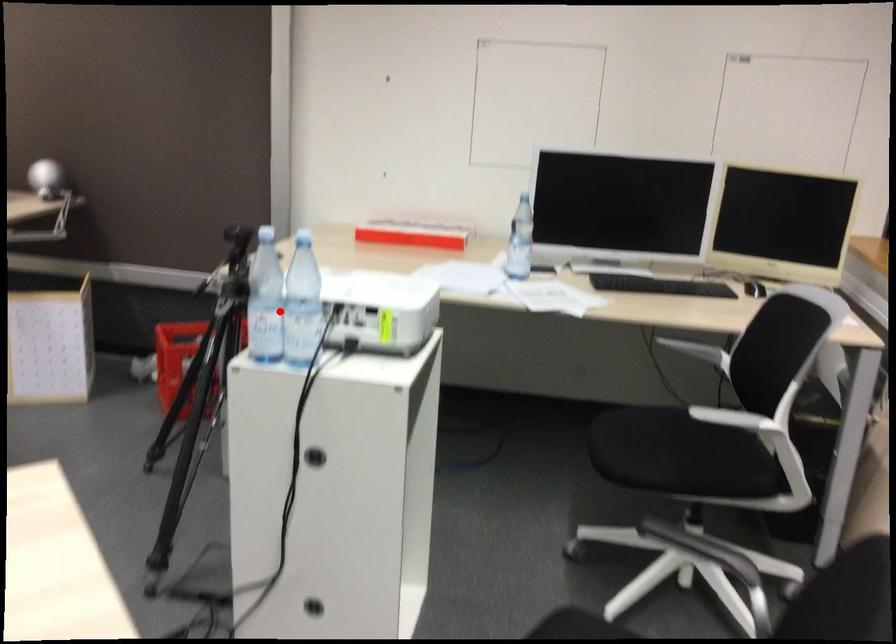
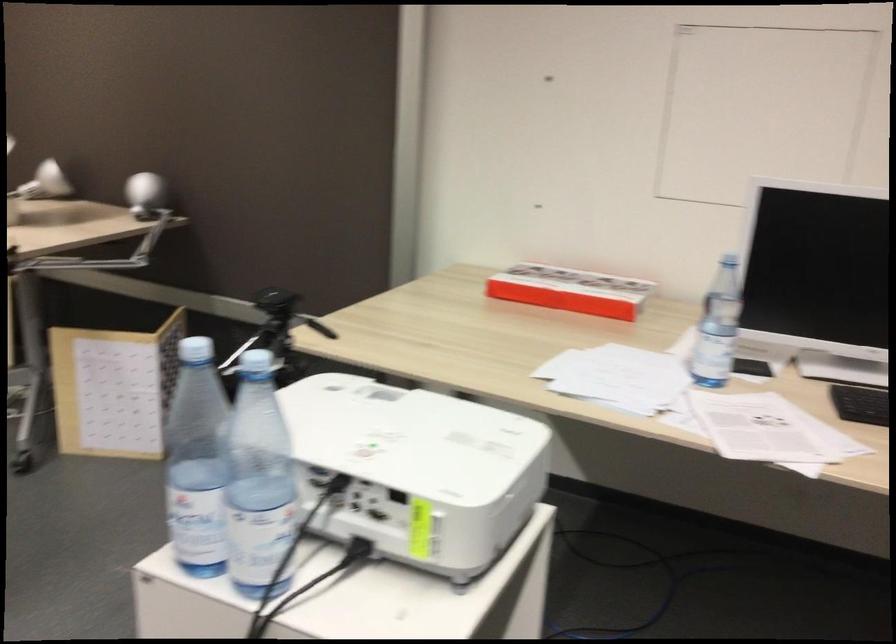
Question: I am providing you with two images of the same scene from different viewpoints. Image1 has a red point marked. In image2, the corresponding 3D location appears at what relative position? Reply with the corresponding letter.

Choices:
 (A) Closer
 (B) Farther

Answer: (A)